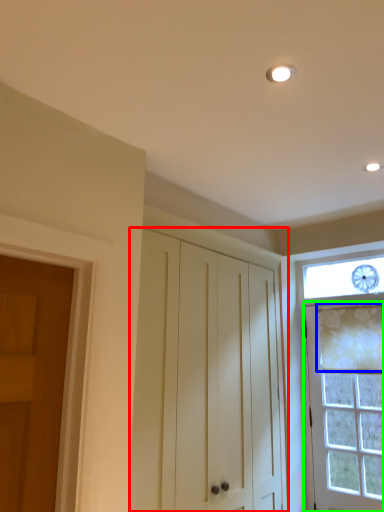
Question: Considering the real-world distances, which object is closest to cabinetry (highlighted by a red box)? curtain (highlighted by a blue box) or door (highlighted by a green box).

Choices:
 (A) curtain
 (B) door

Answer: (B)